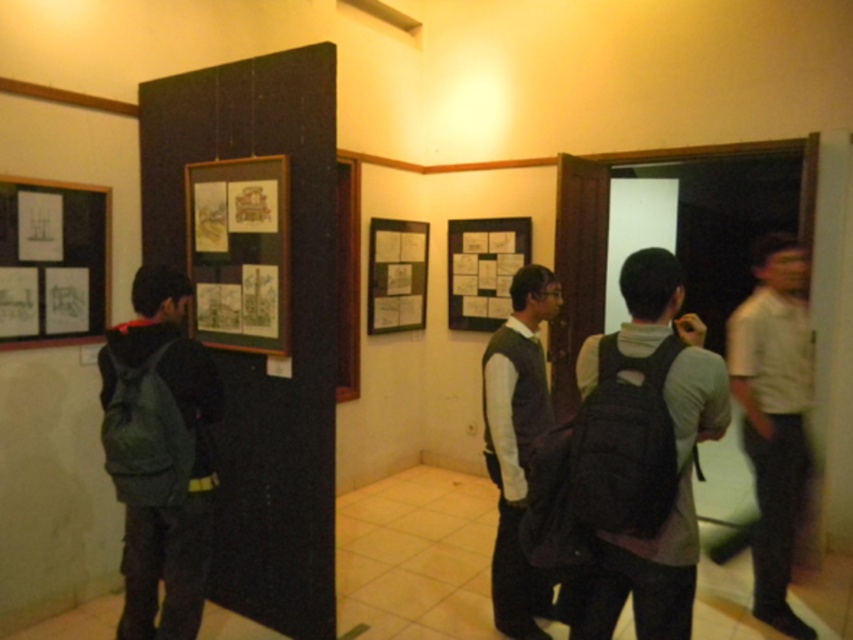
Between dark gray sweater at center and matte paper poster at center, which one appears on the right side from the viewer's perspective?

dark gray sweater at center

Between point (532, 380) and point (368, 276), which one is positioned in front?

Point (532, 380)

What do you see at coordinates (515, 442) in the screenshot? I see `dark gray sweater at center` at bounding box center [515, 442].

Identify the location of dark gray sweater at center. The width and height of the screenshot is (853, 640). (515, 442).

Who is higher up, white matte shirt at right or matte paper poster at center?

matte paper poster at center is above.

Can you confirm if white matte shirt at right is wider than matte paper poster at center?

Yes, white matte shirt at right is wider than matte paper poster at center.

Find the location of a particular element. The height and width of the screenshot is (640, 853). white matte shirt at right is located at coordinates (773, 419).

The width and height of the screenshot is (853, 640). Identify the location of white matte shirt at right. [x=773, y=419].

Is dark gray sweater at center to the left of white paper posters at left from the viewer's perspective?

No, dark gray sweater at center is not to the left of white paper posters at left.

Which of these two, dark gray sweater at center or white paper posters at left, stands taller?

Standing taller between the two is dark gray sweater at center.

Where is `dark gray sweater at center`? The height and width of the screenshot is (640, 853). dark gray sweater at center is located at coordinates (515, 442).